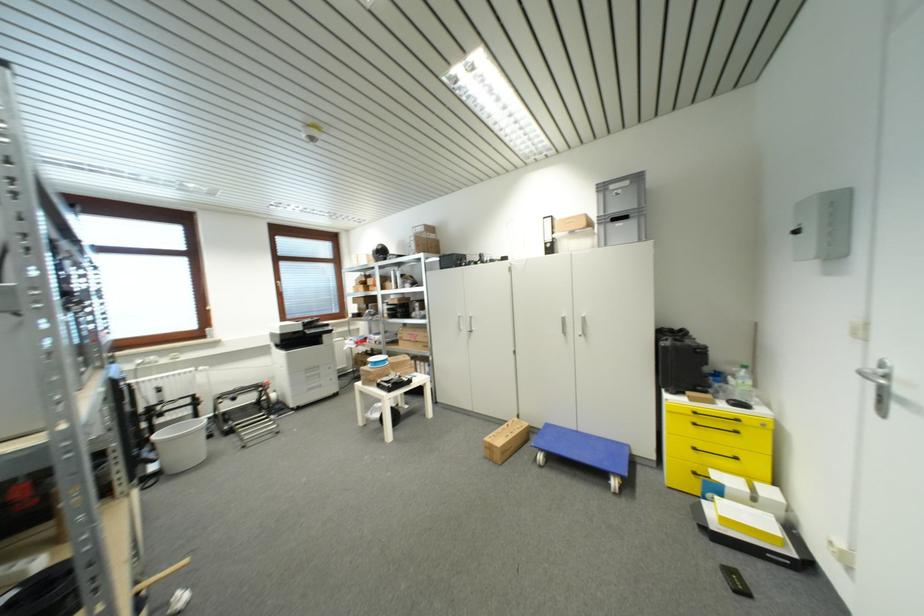
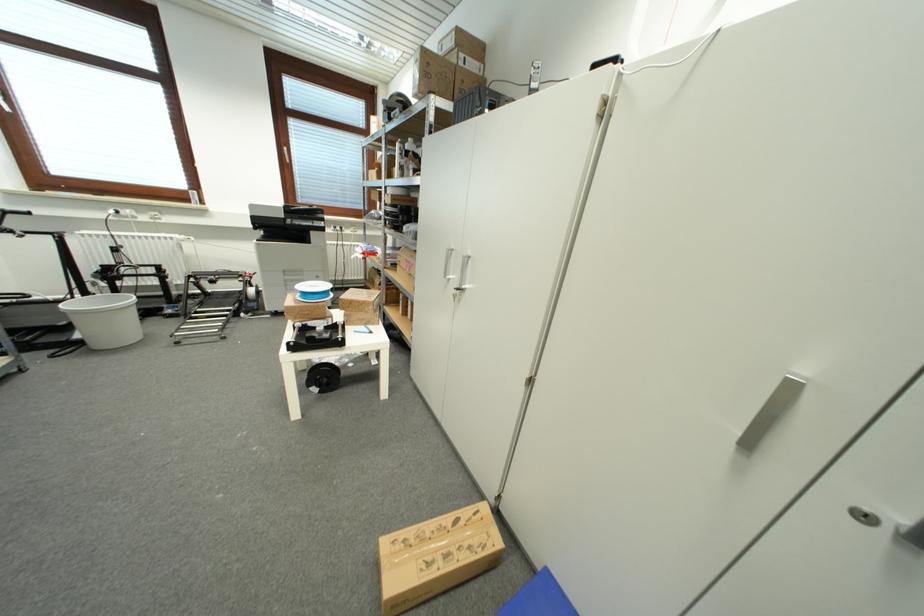
Question: Which direction would the cameraman need to move to produce the second image? Reply with the corresponding letter.

Choices:
 (A) Left
 (B) Right
 (C) Forward
 (D) Backward

Answer: (C)